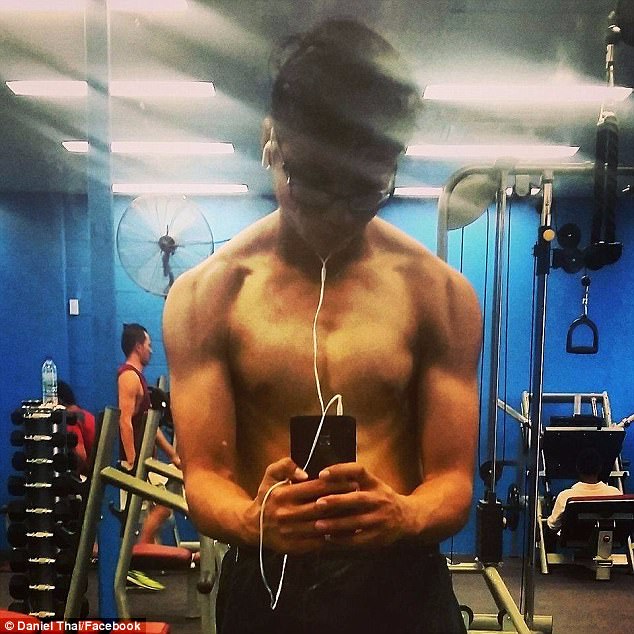
At what (x,y) coordinates should I click in order to perform the action: click on possible gray treadmill. Please return your answer as a coordinate pair (x, y). Looking at the image, I should click on (153, 495), (165, 470).